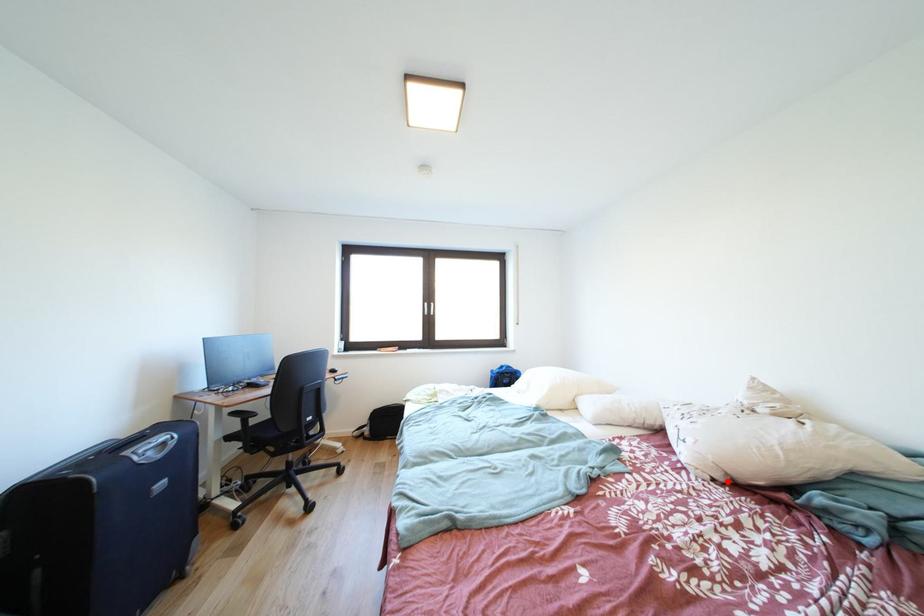
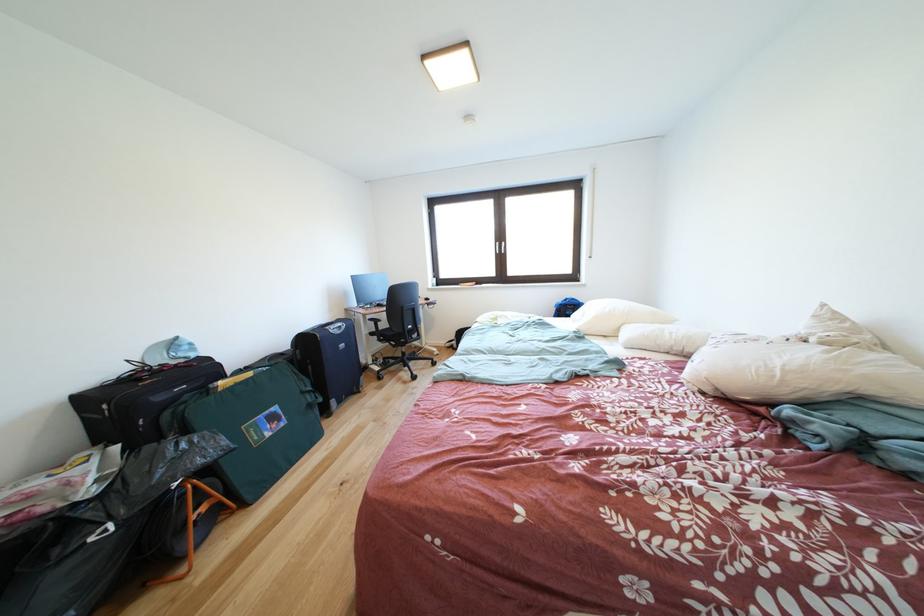
Locate, in the second image, the point that corresponds to the highlighted location in the first image.

(716, 394)